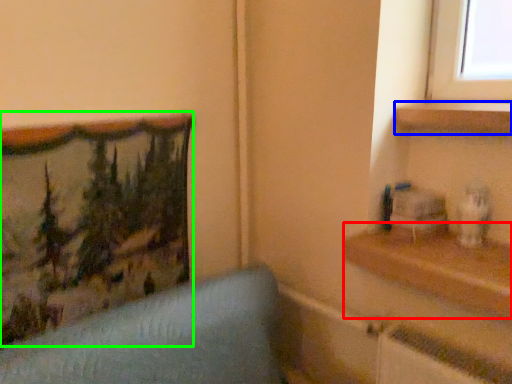
Question: Considering the real-world distances, which object is closest to shelf (highlighted by a red box)? shelf (highlighted by a blue box) or picture frame (highlighted by a green box).

Choices:
 (A) shelf
 (B) picture frame

Answer: (A)